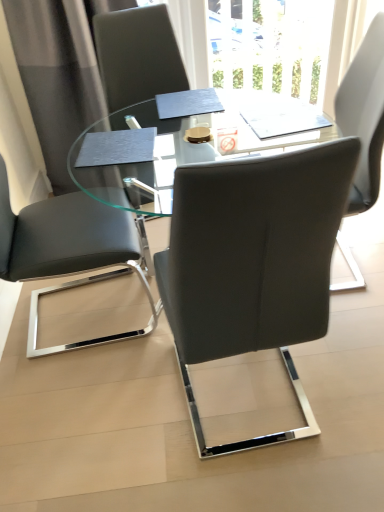
Identify the location of free space in front of matte gray chair at center, which is the 1th chair from right to left. This screenshot has width=384, height=512. (266, 480).